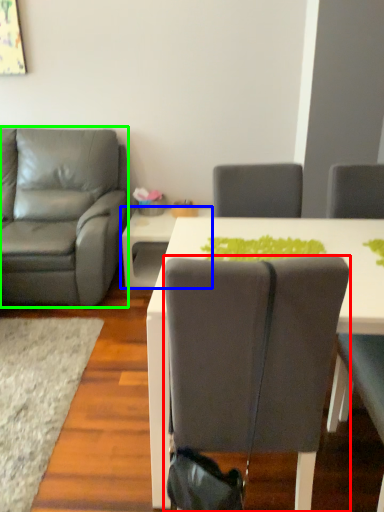
Question: Which is nearer to the chair (highlighted by a red box)? table (highlighted by a blue box) or chair (highlighted by a green box).

Choices:
 (A) table
 (B) chair

Answer: (B)